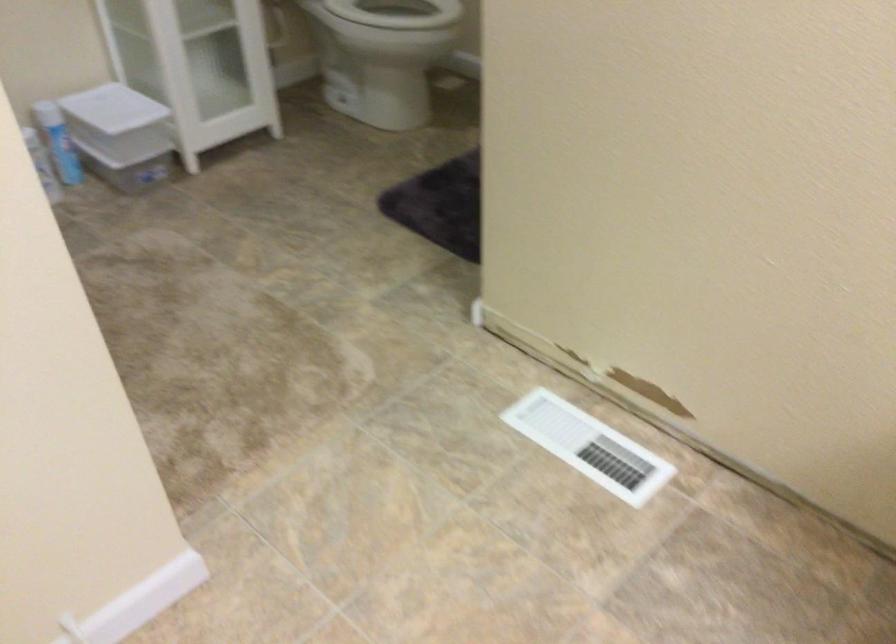
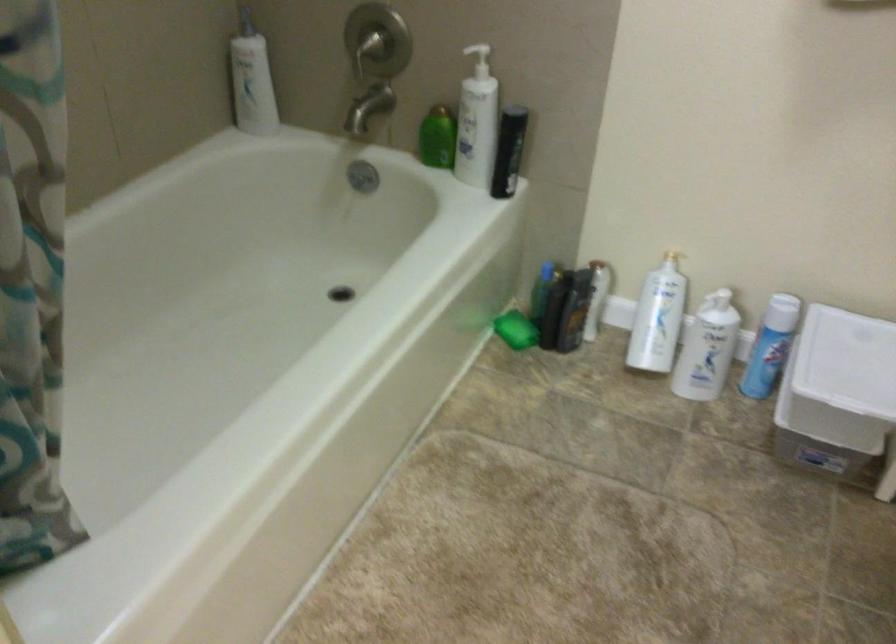
Locate, in the second image, the point that corresponds to (124,109) in the first image.

(847, 361)